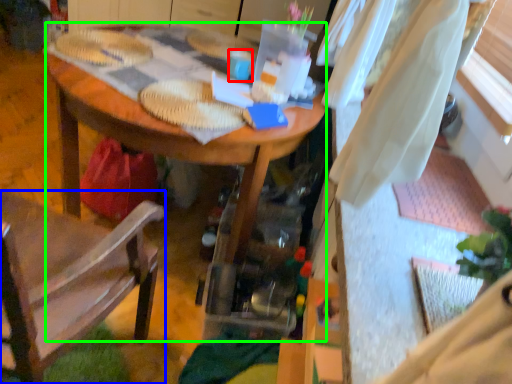
Question: Which object is the closest to the coffee cup (highlighted by a red box)? Choose among these: chair (highlighted by a blue box) or desk (highlighted by a green box).

Choices:
 (A) chair
 (B) desk

Answer: (B)